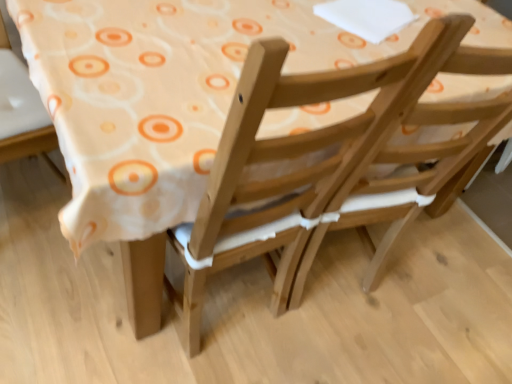
Question: Is point (256, 102) positioned closer to the camera than point (37, 155)?

Choices:
 (A) closer
 (B) farther

Answer: (A)

Question: Considering the positions of natural wood chair at center, which ranks as the second chair in left-to-right order, and wooden chair at lower left, arranged as the second chair when viewed from the right, in the image, is natural wood chair at center, which ranks as the second chair in left-to-right order, wider or thinner than wooden chair at lower left, arranged as the second chair when viewed from the right,?

Choices:
 (A) wide
 (B) thin

Answer: (A)

Question: From the image's perspective, is natural wood chair at center, which ranks as the second chair in left-to-right order, positioned above or below wooden chair at lower left, positioned as the 1th chair in left-to-right order?

Choices:
 (A) above
 (B) below

Answer: (B)

Question: Considering the positions of wooden chair at lower left, arranged as the second chair when viewed from the right, and natural wood chair at center, acting as the 1th chair starting from the right, in the image, is wooden chair at lower left, arranged as the second chair when viewed from the right, wider or thinner than natural wood chair at center, acting as the 1th chair starting from the right,?

Choices:
 (A) thin
 (B) wide

Answer: (A)

Question: Is wooden chair at lower left, positioned as the 1th chair in left-to-right order, bigger or smaller than natural wood chair at center, which ranks as the second chair in left-to-right order?

Choices:
 (A) big
 (B) small

Answer: (B)

Question: Is wooden chair at lower left, positioned as the 1th chair in left-to-right order, situated inside natural wood chair at center, which ranks as the second chair in left-to-right order, or outside?

Choices:
 (A) outside
 (B) inside

Answer: (A)

Question: Considering their positions, is wooden chair at lower left, arranged as the second chair when viewed from the right, located in front of or behind natural wood chair at center, which ranks as the second chair in left-to-right order?

Choices:
 (A) behind
 (B) front

Answer: (A)